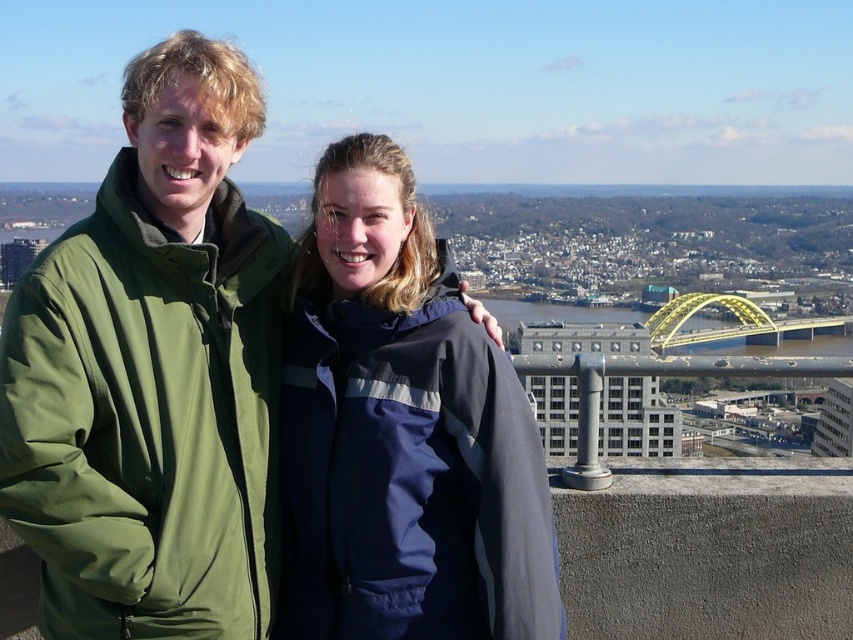
At what (x,y) coordinates should I click in order to perform the action: click on green matte jacket at left. Please return your answer as a coordinate pair (x, y). Looking at the image, I should click on (154, 372).

Which of these two, green matte jacket at left or navy blue jacket at center, stands shorter?

navy blue jacket at center

Is point (125, 404) farther from camera compared to point (457, 618)?

That is False.

Locate an element on the screen. green matte jacket at left is located at coordinates (154, 372).